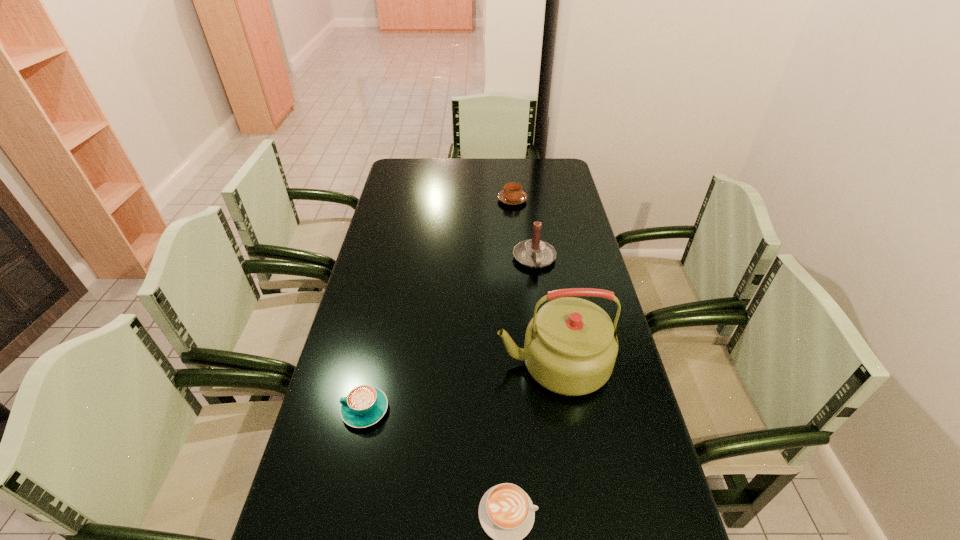
This screenshot has width=960, height=540. Identify the location of vacant region between the tallest object and the farthest cappuccino. (533, 282).

You are a GUI agent. You are given a task and a screenshot of the screen. Output one action in this format:
    pyautogui.click(x=<x>, y=<y>)
    Task: Click on the vacant space that is in between the tallest object and the second farthest cappuccino
    The width and height of the screenshot is (960, 540).
    Given the screenshot: What is the action you would take?
    pyautogui.click(x=459, y=387)

What are the coordinates of `free space that is in between the farthest object and the second farthest object` in the screenshot? It's located at (523, 230).

Identify the location of the third closest object to the farthest cappuccino. (365, 405).

Locate which object ranks third in proximity to the second tallest object. Please provide its 2D coordinates. Your answer should be formatted as a tuple, i.e. [(x, y)], where the tuple contains the x and y coordinates of a point satisfying the conditions above.

[(365, 405)]

Choose which cappuccino is the second nearest neighbor to the kettle. Please provide its 2D coordinates. Your answer should be formatted as a tuple, i.e. [(x, y)], where the tuple contains the x and y coordinates of a point satisfying the conditions above.

[(365, 405)]

Choose which cappuccino is the second nearest neighbor to the farthest cappuccino. Please provide its 2D coordinates. Your answer should be formatted as a tuple, i.e. [(x, y)], where the tuple contains the x and y coordinates of a point satisfying the conditions above.

[(506, 513)]

What are the coordinates of `free spot that satisfies the following two spatial constraints: 1. on the side of the second farthest object with the handle loop; 2. with the handle on the right side of the leftmost cappuccino` in the screenshot? It's located at (556, 410).